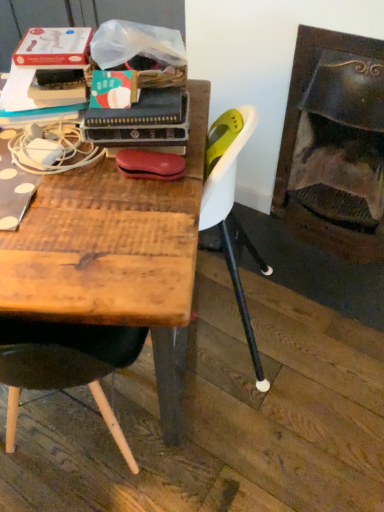
The height and width of the screenshot is (512, 384). What do you see at coordinates (115, 255) in the screenshot?
I see `wooden table at center` at bounding box center [115, 255].

Find the location of `wooden table at center`. wooden table at center is located at coordinates (115, 255).

From the picture: In order to face wooden table at center, should I rotate leftwards or rightwards?

You should look left and rotate roughly 18.354 degrees.

What do you see at coordinates (334, 145) in the screenshot? This screenshot has width=384, height=512. I see `dark brown wood fireplace at right` at bounding box center [334, 145].

At what (x,y) coordinates should I click in order to perform the action: click on dark brown wood fireplace at right. Please return your answer as a coordinate pair (x, y). Looking at the image, I should click on (334, 145).

Locate an element on the screen. The height and width of the screenshot is (512, 384). wooden table at center is located at coordinates (115, 255).

Visually, is dark brown wood fireplace at right positioned to the left or to the right of wooden table at center?

Based on their positions, dark brown wood fireplace at right is located to the right of wooden table at center.

Is dark brown wood fireplace at right further to camera compared to wooden table at center?

Yes, dark brown wood fireplace at right is further from the viewer.

Is point (366, 124) more distant than point (184, 328)?

Yes.

From the image's perspective, which one is positioned higher, dark brown wood fireplace at right or wooden table at center?

dark brown wood fireplace at right, from the image's perspective.

From a real-world perspective, which object stands above the other?

dark brown wood fireplace at right is physically above.

Considering the sizes of objects dark brown wood fireplace at right and wooden table at center in the image provided, who is thinner, dark brown wood fireplace at right or wooden table at center?

Thinner between the two is dark brown wood fireplace at right.

Considering the relative sizes of dark brown wood fireplace at right and wooden table at center in the image provided, is dark brown wood fireplace at right shorter than wooden table at center?

In fact, dark brown wood fireplace at right may be taller than wooden table at center.

In terms of size, does dark brown wood fireplace at right appear bigger or smaller than wooden table at center?

In the image, dark brown wood fireplace at right appears to be smaller than wooden table at center.

Is dark brown wood fireplace at right not inside wooden table at center?

dark brown wood fireplace at right is positioned outside wooden table at center.

Is dark brown wood fireplace at right not near wooden table at center?

They are positioned close to each other.

Does dark brown wood fireplace at right turn towards wooden table at center?

Yes, dark brown wood fireplace at right is aimed at wooden table at center.

How different are the orientations of dark brown wood fireplace at right and wooden table at center in degrees?

dark brown wood fireplace at right and wooden table at center are facing 29.1 degrees away from each other.

How much distance is there between dark brown wood fireplace at right and wooden table at center?

dark brown wood fireplace at right is 34.05 inches away from wooden table at center.

The width and height of the screenshot is (384, 512). Find the location of `table to the left of dark brown wood fireplace at right`. table to the left of dark brown wood fireplace at right is located at coordinates (115, 255).

Considering the relative positions of wooden table at center and dark brown wood fireplace at right in the image provided, is wooden table at center to the right of dark brown wood fireplace at right from the viewer's perspective?

Incorrect, wooden table at center is not on the right side of dark brown wood fireplace at right.

Does wooden table at center come in front of dark brown wood fireplace at right?

Yes.

Considering the positions of points (80, 193) and (318, 116), is point (80, 193) closer to camera compared to point (318, 116)?

Yes, point (80, 193) is in front of point (318, 116).

From the image's perspective, between wooden table at center and dark brown wood fireplace at right, who is located below?

From the image's view, wooden table at center is below.

Looking at this image, from a real-world perspective, who is located lower, wooden table at center or dark brown wood fireplace at right?

wooden table at center, from a real-world perspective.

Considering the sizes of objects wooden table at center and dark brown wood fireplace at right in the image provided, who is wider, wooden table at center or dark brown wood fireplace at right?

With larger width is wooden table at center.

In the scene shown: Is wooden table at center taller or shorter than dark brown wood fireplace at right?

Clearly, wooden table at center is shorter compared to dark brown wood fireplace at right.

Who is smaller, wooden table at center or dark brown wood fireplace at right?

With smaller size is dark brown wood fireplace at right.

Is wooden table at center located outside dark brown wood fireplace at right?

Yes.

Is wooden table at center positioned far away from dark brown wood fireplace at right?

wooden table at center is near dark brown wood fireplace at right, not far away.

Is wooden table at center aimed at dark brown wood fireplace at right?

No, wooden table at center is not aimed at dark brown wood fireplace at right.

The width and height of the screenshot is (384, 512). What are the coordinates of `fireplace above the wooden table at center (from the image's perspective)` in the screenshot? It's located at (334, 145).

You are a GUI agent. You are given a task and a screenshot of the screen. Output one action in this format:
    pyautogui.click(x=<x>, y=<y>)
    Task: Click on the fireplace that is above the wooden table at center (from the image's perspective)
    This screenshot has width=384, height=512.
    Given the screenshot: What is the action you would take?
    pyautogui.click(x=334, y=145)

What are the coordinates of `fireplace that is above the wooden table at center (from a real-world perspective)` in the screenshot? It's located at (334, 145).